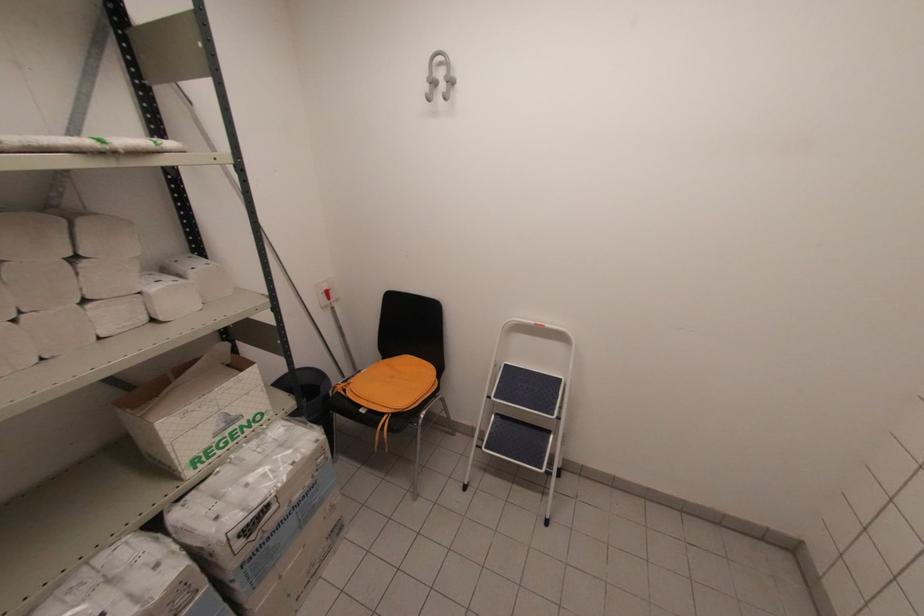
The location [311,398] corresponds to which object?

This point indicates the black trash can.